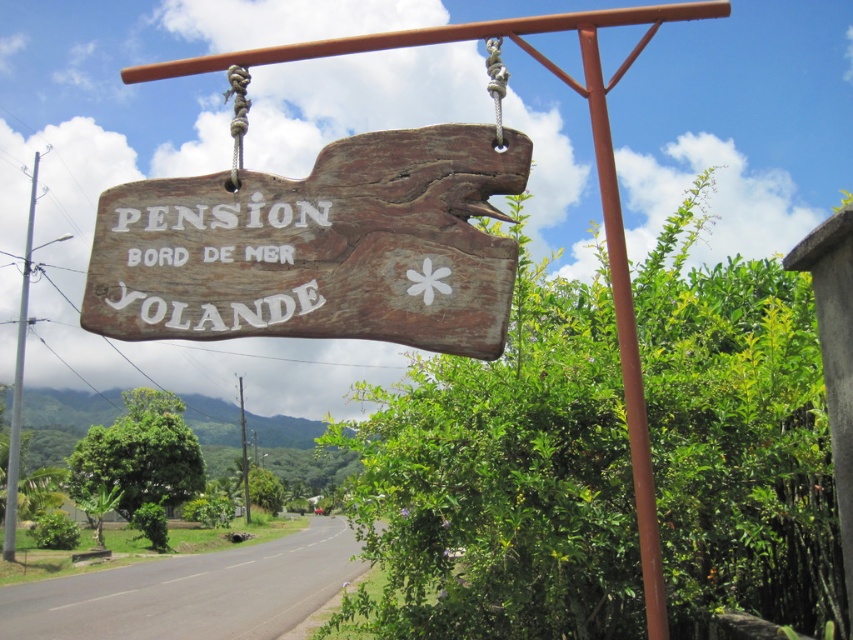
Looking at this image, you are driving along a tropical road and spot the weathered wood sign at center and the rusty metal pole at upper center ahead. Which object would appear larger in your view?

The weathered wood sign at center appears larger because it is closer to the viewer than the rusty metal pole at upper center.

You are driving along a road and see the weathered wood sign at center and the brown wooden pole at center ahead. Which object is positioned more to your right side?

The weathered wood sign at center is positioned to the right of the brown wooden pole at center, so it is more to the right side.